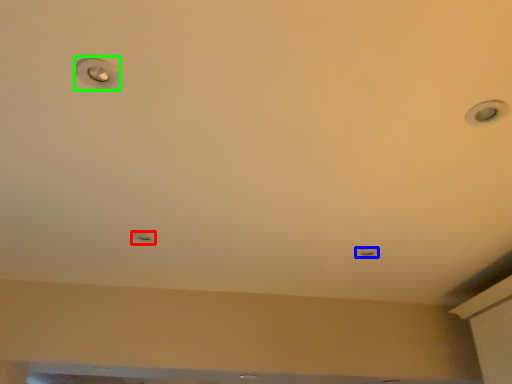
Question: Which object is the farthest from droplight (highlighted by a red box)? Choose among these: light (highlighted by a blue box) or droplight (highlighted by a green box).

Choices:
 (A) light
 (B) droplight

Answer: (A)